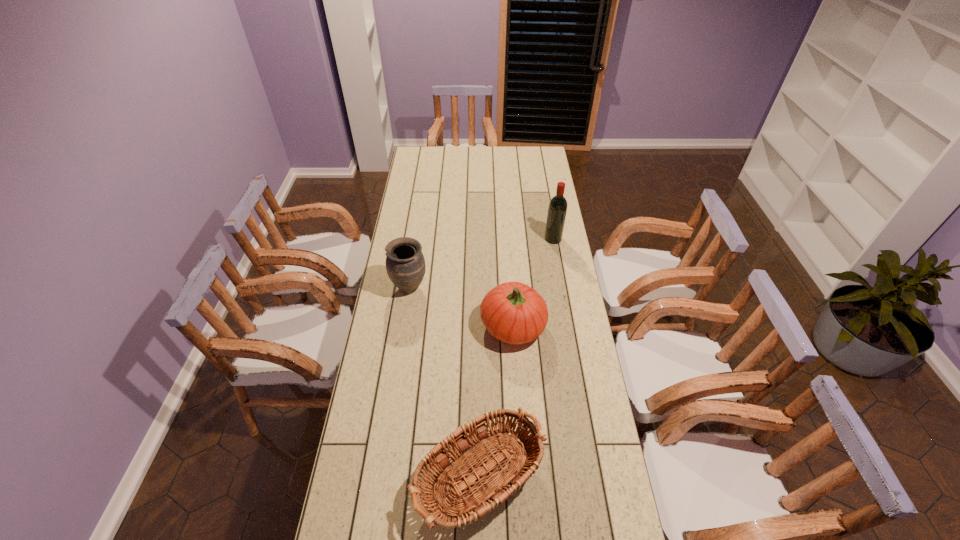
Locate an element on the screen. wine bottle is located at coordinates (557, 209).

Where is `the rightmost object`? the rightmost object is located at coordinates (557, 209).

This screenshot has height=540, width=960. What are the coordinates of `urn` in the screenshot? It's located at (405, 264).

In order to click on pumpkin in this screenshot , I will do `click(513, 312)`.

Find the location of a particular element. blank area located 0.070m on the label of the rightmost object is located at coordinates (529, 239).

You are a GUI agent. You are given a task and a screenshot of the screen. Output one action in this format:
    pyautogui.click(x=<x>, y=<y>)
    Task: Click on the free region located 0.270m on the label of the rightmost object
    This screenshot has height=540, width=960.
    Given the screenshot: What is the action you would take?
    pyautogui.click(x=486, y=239)

You are a GUI agent. You are given a task and a screenshot of the screen. Output one action in this format:
    pyautogui.click(x=<x>, y=<y>)
    Task: Click on the free space located on the label of the rightmost object
    This screenshot has width=960, height=540.
    Given the screenshot: What is the action you would take?
    pyautogui.click(x=503, y=239)

Find the location of `vacant space located 0.330m on the back of the leftmost object`. vacant space located 0.330m on the back of the leftmost object is located at coordinates (419, 225).

Identify the location of vacant space located 0.270m on the left of the pumpkin. (410, 326).

Identify the location of object located in the left edge section of the desktop. (405, 264).